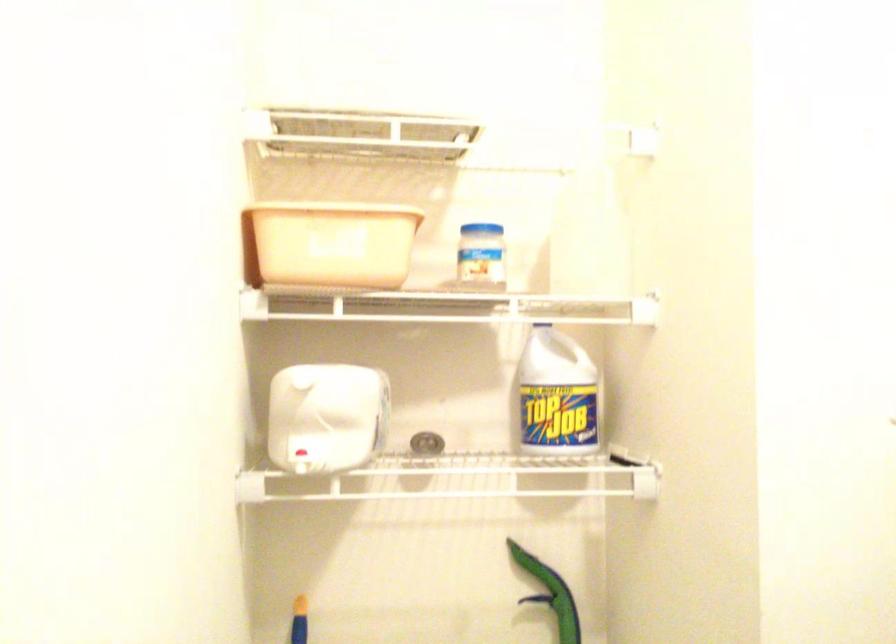
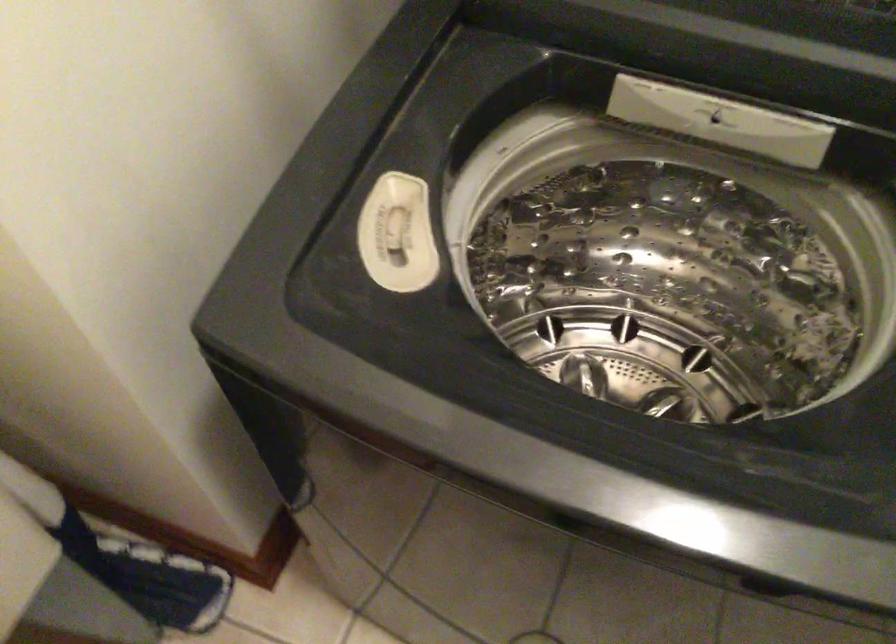
Based on the continuous images, in which direction is the camera rotating?

The camera's rotation is toward right-down.